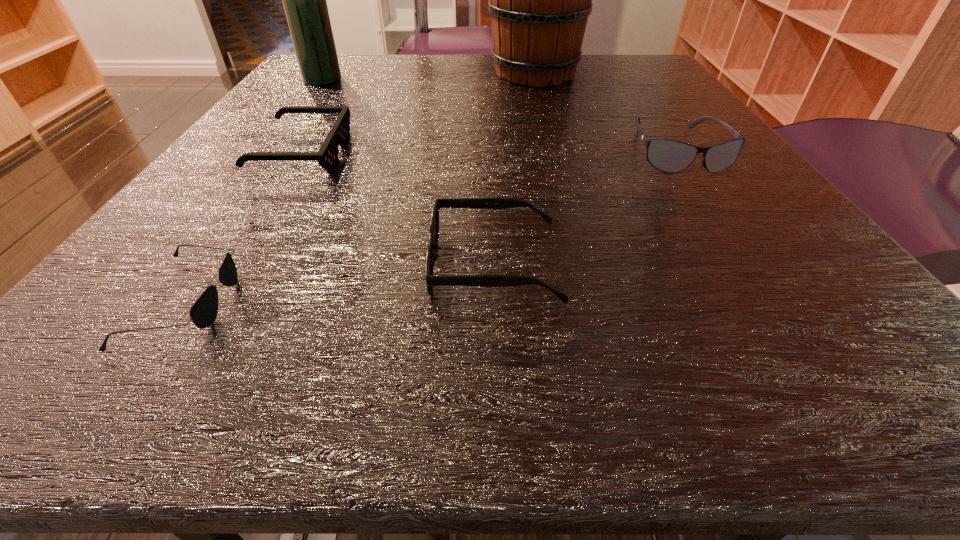
Where is `wine bucket`? wine bucket is located at coordinates (539, 0).

Find the location of `alcohol`. alcohol is located at coordinates click(304, 0).

Locate an element on the screen. This screenshot has width=960, height=540. the rightmost object is located at coordinates (667, 155).

This screenshot has width=960, height=540. Find the location of `the second sunglasses from right to left`. the second sunglasses from right to left is located at coordinates (494, 280).

Locate an element on the screen. the shortest sunglasses is located at coordinates (203, 313).

Where is `free space located 0.270m on the left of the wine bucket`? Image resolution: width=960 pixels, height=540 pixels. free space located 0.270m on the left of the wine bucket is located at coordinates (362, 73).

The width and height of the screenshot is (960, 540). I want to click on vacant region located on the right of the alcohol, so click(x=515, y=79).

Image resolution: width=960 pixels, height=540 pixels. In order to click on blank space located on the lenses of the rightmost sunglasses in this screenshot , I will do `click(726, 222)`.

What are the coordinates of `vacant space situated 0.240m at the front lenses of the third sunglasses from left to right` in the screenshot? It's located at (216, 265).

This screenshot has width=960, height=540. I want to click on vacant area located 0.270m at the front lenses of the third sunglasses from left to right, so click(x=189, y=265).